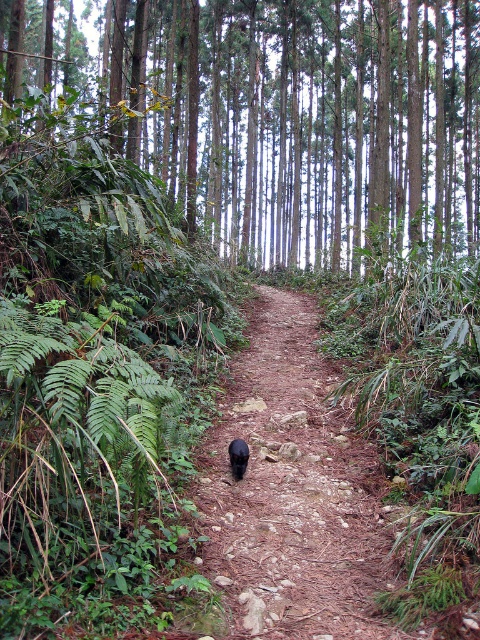
Image resolution: width=480 pixels, height=640 pixels. What do you see at coordinates (280, 115) in the screenshot?
I see `green smooth trees at center` at bounding box center [280, 115].

Between point (171, 70) and point (288, 353), which one is positioned in front?

Point (288, 353) is more forward.

The width and height of the screenshot is (480, 640). Describe the element at coordinates (280, 115) in the screenshot. I see `green smooth trees at center` at that location.

Where is `green smooth trees at center`? The height and width of the screenshot is (640, 480). green smooth trees at center is located at coordinates [x=280, y=115].

Who is positioned more to the right, brown dirt path at center or black fur cat at center?

From the viewer's perspective, brown dirt path at center appears more on the right side.

Measure the distance from brown dirt path at center to black fur cat at center.

brown dirt path at center and black fur cat at center are 12.28 inches apart.

Where is `brown dirt path at center`? The height and width of the screenshot is (640, 480). brown dirt path at center is located at coordinates (290, 493).

Describe the element at coordinates (280, 115) in the screenshot. I see `green smooth trees at center` at that location.

Does point (317, 173) lie behind point (231, 460)?

Yes, point (317, 173) is behind point (231, 460).

You are a GUI agent. You are given a task and a screenshot of the screen. Output one action in this format:
    pyautogui.click(x=<x>, y=<y>)
    Task: Click on the green smooth trees at center
    
    Given the screenshot: What is the action you would take?
    pyautogui.click(x=280, y=115)